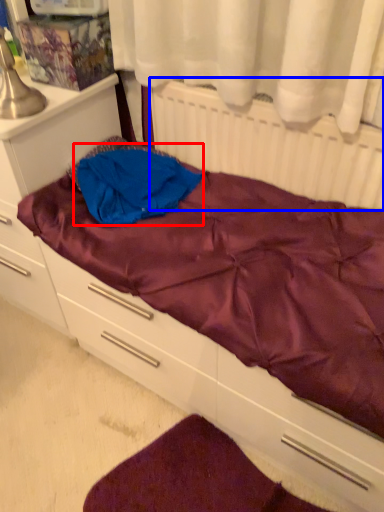
Question: Which point is further to the camera, clothing (highlighted by a red box) or radiator (highlighted by a blue box)?

Choices:
 (A) clothing
 (B) radiator

Answer: (A)